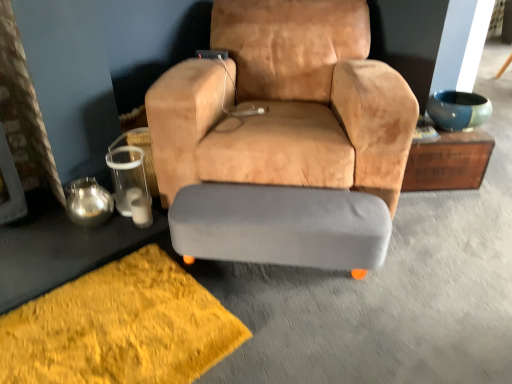
Where is `vacant space in between gray fabric ottoman at center and shaggy yellow rug at lower left`? vacant space in between gray fabric ottoman at center and shaggy yellow rug at lower left is located at coordinates (287, 322).